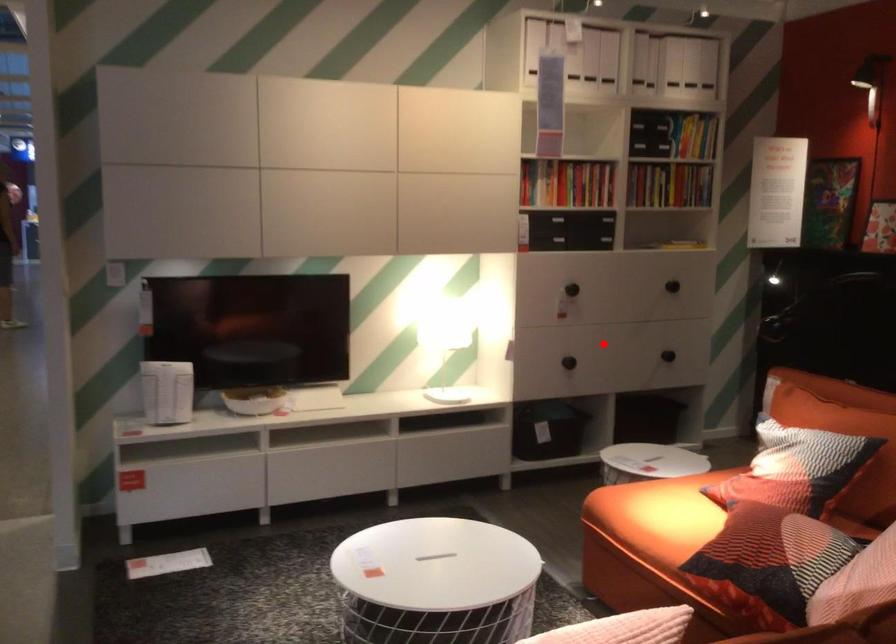
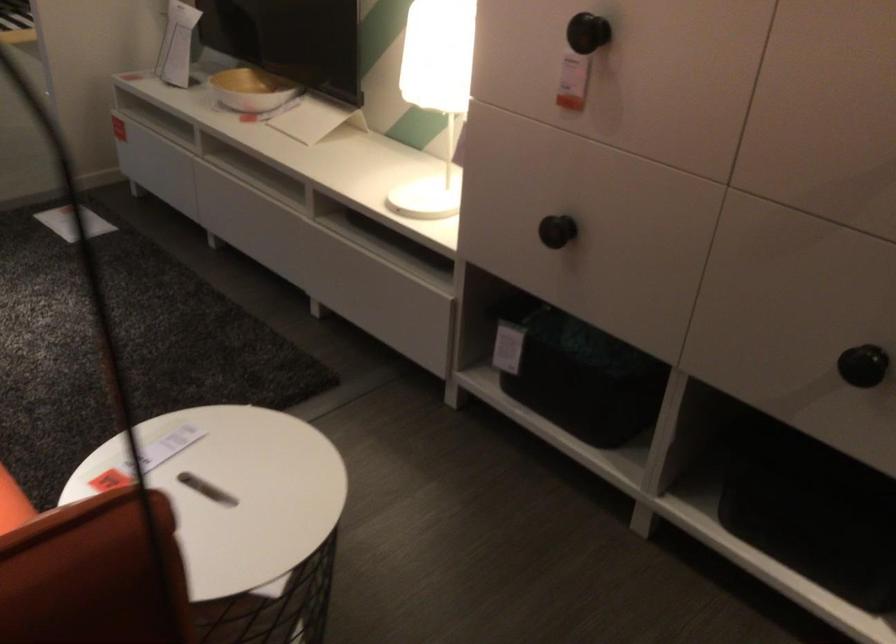
The point at the highlighted location is marked in the first image. Where is the corresponding point in the second image?

(556, 231)